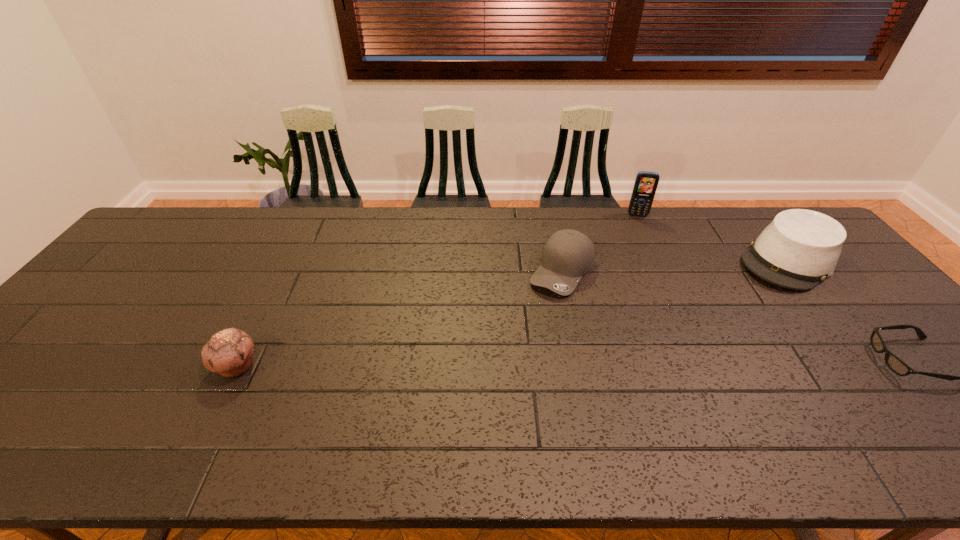
Locate an element on the screen. Image resolution: width=960 pixels, height=540 pixels. vacant space on the desktop that is between the muffin and the spectacles and is positioned on the front-facing side of the hat is located at coordinates (671, 362).

Image resolution: width=960 pixels, height=540 pixels. Find the location of `free spot on the desktop that is between the muffin and the spectacles and is positioned on the front brim of the second object from left to right`. free spot on the desktop that is between the muffin and the spectacles and is positioned on the front brim of the second object from left to right is located at coordinates (509, 363).

In order to click on free space on the desktop that is between the leftmost object and the spectacles and is positioned on the screen of the farthest object in this screenshot , I will do `click(652, 363)`.